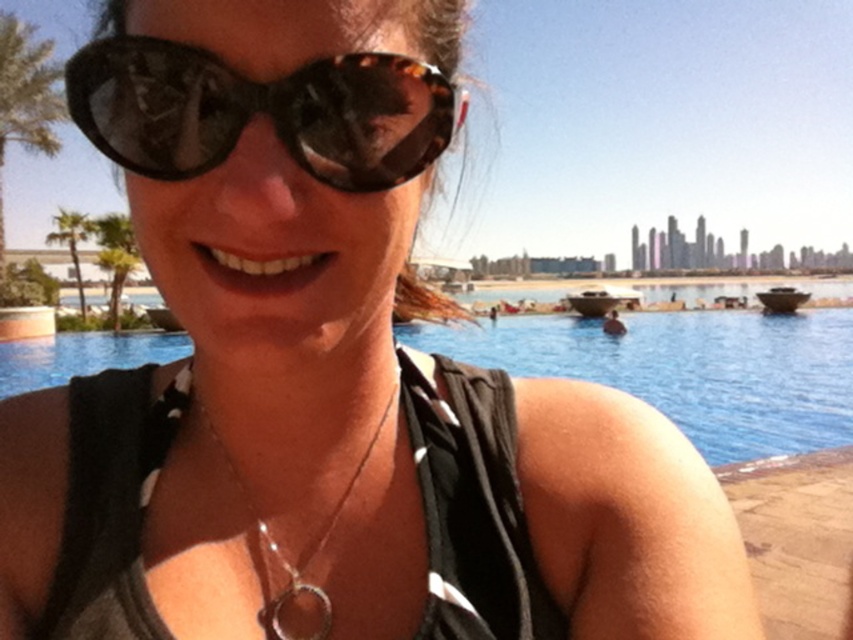
Question: Can you confirm if tortoiseshell sunglasses at center is positioned below silver metallic necklace at center?

Choices:
 (A) yes
 (B) no

Answer: (B)

Question: Estimate the real-world distances between objects in this image. Which object is closer to the silver metallic necklace at center?

Choices:
 (A) blue glass swimming pool at center
 (B) tortoiseshell sunglasses at center

Answer: (B)

Question: From the image, what is the correct spatial relationship of blue glass swimming pool at center in relation to tortoiseshell sunglasses at center?

Choices:
 (A) below
 (B) above

Answer: (A)

Question: Estimate the real-world distances between objects in this image. Which object is closer to the silver metallic necklace at center?

Choices:
 (A) blue glass swimming pool at center
 (B) tortoiseshell sunglasses at center

Answer: (B)

Question: Can you confirm if blue glass swimming pool at center is positioned to the right of silver metallic necklace at center?

Choices:
 (A) yes
 (B) no

Answer: (A)

Question: Which of the following is the closest to the observer?

Choices:
 (A) (785, 428)
 (B) (131, 166)
 (C) (263, 534)

Answer: (B)